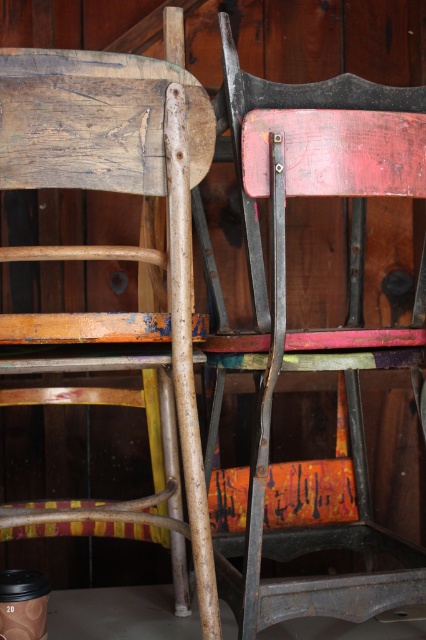
From the picture: You are standing in a room with two chairs. You see a red painted wood chair at center and a wooden chair at center. Which one is positioned more to the right side of the room?

The red painted wood chair at center is positioned more to the right side of the room than the wooden chair at center.

You are standing in front of two chairs against a wooden wall. You see a point labeled as point (374, 90) and another point labeled as point (51, 164). Which point is closer to you?

Point (374, 90) is further to the viewer than point (51, 164), so the point closer to you is point (51, 164).

From the picture: You are an interior designer assessing the placement of furniture in a room. You have a 1.8 meters tall ceiling height. You need to decide whether the red painted wood chair at center and the wooden chair at center can be placed under a low ceiling without touching it. Can both chairs fit under the ceiling?

The red painted wood chair at center is taller than the wooden chair at center. Since the ceiling height is 1.8 meters, if the taller chair does not exceed this height, both can fit. However, if the red painted wood chair at center is taller than 1.8 meters, it would hit the ceiling. Without specific measurements, we cannot confirm, but the description only states their relative height, not absolute. Thus, it depends on their actual heights.